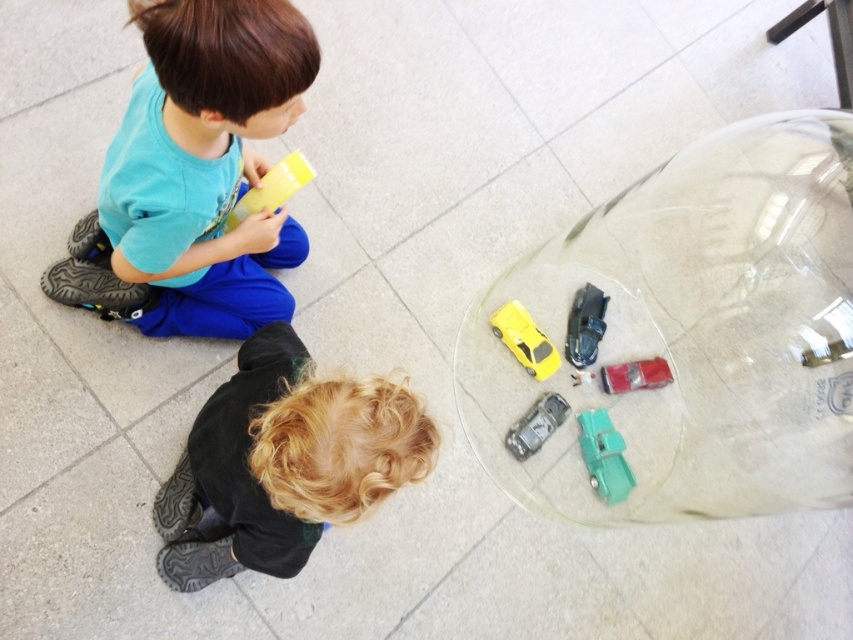
Question: Does matte green car at lower right appear over metallic silver toy car at lower center?

Choices:
 (A) yes
 (B) no

Answer: (B)

Question: Which object is positioned closest to the yellow matte car at lower center?

Choices:
 (A) metallic silver toy car at lower center
 (B) transparent glass bubble at center
 (C) blonde curly hair at lower center

Answer: (A)

Question: Is matte blue shirt at upper left above yellow matte block at upper center?

Choices:
 (A) no
 (B) yes

Answer: (B)

Question: Does matte blue shirt at upper left appear under yellow matte block at upper center?

Choices:
 (A) yes
 (B) no

Answer: (B)

Question: Which point appears farthest from the camera in this image?

Choices:
 (A) (627, 477)
 (B) (515, 333)
 (C) (184, 307)

Answer: (A)

Question: Among these points, which one is farthest from the camera?

Choices:
 (A) (283, 166)
 (B) (544, 372)

Answer: (B)